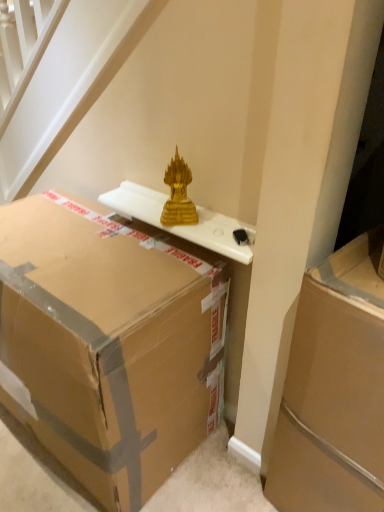
Image resolution: width=384 pixels, height=512 pixels. Describe the element at coordinates (334, 389) in the screenshot. I see `brown cardboard box at right, which is the second box from left to right` at that location.

What do you see at coordinates (183, 225) in the screenshot? I see `white glossy table at upper center` at bounding box center [183, 225].

Image resolution: width=384 pixels, height=512 pixels. I want to click on gold glass sculpture at upper center, so pyautogui.click(x=178, y=195).

Identify the location of brown cardboard box at right, arranged as the 1th box when viewed from the right. (334, 389).

From a real-world perspective, is gold glass sculpture at upper center above or below brown cardboard box at right, arranged as the 1th box when viewed from the right?

In terms of real-world spatial position, gold glass sculpture at upper center is above brown cardboard box at right, arranged as the 1th box when viewed from the right.

Between gold glass sculpture at upper center and brown cardboard box at right, arranged as the 1th box when viewed from the right, which one has larger size?

brown cardboard box at right, arranged as the 1th box when viewed from the right.

Is point (172, 175) positioned in front of point (319, 429)?

No.

From their relative heights in the image, would you say gold glass sculpture at upper center is taller or shorter than brown cardboard box at right, arranged as the 1th box when viewed from the right?

Considering their sizes, gold glass sculpture at upper center has less height than brown cardboard box at right, arranged as the 1th box when viewed from the right.

Where is `box directly beneath the brown cardboard box at right, which is the second box from left to right (from a real-world perspective)`? This screenshot has height=512, width=384. box directly beneath the brown cardboard box at right, which is the second box from left to right (from a real-world perspective) is located at coordinates tap(108, 345).

Is brown cardboard box at right, which is the second box from left to right, in contact with brown cardboard box at center, positioned as the 1th box in left-to-right order?

No, brown cardboard box at right, which is the second box from left to right, is not touching brown cardboard box at center, positioned as the 1th box in left-to-right order.

Can brown cardboard box at center, positioned as the 1th box in left-to-right order, be found inside brown cardboard box at right, arranged as the 1th box when viewed from the right?

Definitely not — brown cardboard box at center, positioned as the 1th box in left-to-right order, is not inside brown cardboard box at right, arranged as the 1th box when viewed from the right.

From the image's perspective, is brown cardboard box at right, which is the second box from left to right, over brown cardboard box at center, which appears as the second box when viewed from the right?

No, from the image's perspective, brown cardboard box at right, which is the second box from left to right, is not over brown cardboard box at center, which appears as the second box when viewed from the right.

Which is in front, point (65, 234) or point (178, 194)?

Positioned in front is point (178, 194).

From a real-world perspective, who is located lower, brown cardboard box at center, which appears as the second box when viewed from the right, or gold glass sculpture at upper center?

From a 3D spatial view, brown cardboard box at center, which appears as the second box when viewed from the right, is below.

Is brown cardboard box at center, positioned as the 1th box in left-to-right order, spatially inside gold glass sculpture at upper center, or outside of it?

brown cardboard box at center, positioned as the 1th box in left-to-right order, is not enclosed by gold glass sculpture at upper center.

Can you confirm if brown cardboard box at center, which appears as the second box when viewed from the right, is wider than gold glass sculpture at upper center?

Yes, brown cardboard box at center, which appears as the second box when viewed from the right, is wider than gold glass sculpture at upper center.

Can we say gold glass sculpture at upper center lies outside white glossy table at upper center?

Yes.

What's the angular difference between gold glass sculpture at upper center and white glossy table at upper center's facing directions?

The angle between the facing direction of gold glass sculpture at upper center and the facing direction of white glossy table at upper center is 0.00057 degrees.

Does point (176, 205) come closer to viewer compared to point (102, 195)?

Yes.

From a real-world perspective, is brown cardboard box at right, arranged as the 1th box when viewed from the right, on white glossy table at upper center?

Actually, brown cardboard box at right, arranged as the 1th box when viewed from the right, is physically below white glossy table at upper center in the real world.

Which is more to the right, brown cardboard box at right, arranged as the 1th box when viewed from the right, or white glossy table at upper center?

brown cardboard box at right, arranged as the 1th box when viewed from the right, is more to the right.

Are brown cardboard box at right, arranged as the 1th box when viewed from the right, and white glossy table at upper center making contact?

brown cardboard box at right, arranged as the 1th box when viewed from the right, is not next to white glossy table at upper center, and they're not touching.

Between brown cardboard box at right, arranged as the 1th box when viewed from the right, and white glossy table at upper center, which one is positioned behind?

white glossy table at upper center.

Which is further, (124, 217) or (311, 387)?

Point (124, 217)

From the image's perspective, which one is positioned higher, white glossy table at upper center or brown cardboard box at right, arranged as the 1th box when viewed from the right?

From the image's view, white glossy table at upper center is above.

Is white glossy table at upper center facing away from brown cardboard box at right, arranged as the 1th box when viewed from the right?

That's not correct — white glossy table at upper center is not looking away from brown cardboard box at right, arranged as the 1th box when viewed from the right.

Is brown cardboard box at right, arranged as the 1th box when viewed from the right, at the right side of gold glass sculpture at upper center?

Yes.

Can you tell me how much brown cardboard box at right, which is the second box from left to right, and gold glass sculpture at upper center differ in facing direction?

There is a 7.05-degree angle between the facing directions of brown cardboard box at right, which is the second box from left to right, and gold glass sculpture at upper center.

Is brown cardboard box at right, which is the second box from left to right, completely or partially outside of gold glass sculpture at upper center?

Yes.

From the image's perspective, is brown cardboard box at right, which is the second box from left to right, located above gold glass sculpture at upper center?

Actually, brown cardboard box at right, which is the second box from left to right, appears below gold glass sculpture at upper center in the image.

Locate an element on the screen. This screenshot has width=384, height=512. sculpture that appears above the brown cardboard box at right, which is the second box from left to right (from the image's perspective) is located at coordinates (178, 195).

Where is `box behind the brown cardboard box at right, which is the second box from left to right`? This screenshot has height=512, width=384. box behind the brown cardboard box at right, which is the second box from left to right is located at coordinates (108, 345).

From the image, which object appears to be nearer to white glossy table at upper center, brown cardboard box at center, positioned as the 1th box in left-to-right order, or brown cardboard box at right, arranged as the 1th box when viewed from the right?

brown cardboard box at center, positioned as the 1th box in left-to-right order.

From the image, which object appears to be nearer to brown cardboard box at right, which is the second box from left to right, brown cardboard box at center, which appears as the second box when viewed from the right, or white glossy table at upper center?

Among the two, white glossy table at upper center is located nearer to brown cardboard box at right, which is the second box from left to right.

Which object lies nearer to the anchor point brown cardboard box at center, positioned as the 1th box in left-to-right order, white glossy table at upper center or gold glass sculpture at upper center?

white glossy table at upper center.

From the image, which object appears to be farther from brown cardboard box at right, arranged as the 1th box when viewed from the right, white glossy table at upper center or brown cardboard box at center, positioned as the 1th box in left-to-right order?

The object further to brown cardboard box at right, arranged as the 1th box when viewed from the right, is brown cardboard box at center, positioned as the 1th box in left-to-right order.

When comparing their distances from brown cardboard box at right, arranged as the 1th box when viewed from the right, does brown cardboard box at center, positioned as the 1th box in left-to-right order, or gold glass sculpture at upper center seem further?

gold glass sculpture at upper center is positioned further to the anchor brown cardboard box at right, arranged as the 1th box when viewed from the right.

Considering their positions, is white glossy table at upper center positioned further to brown cardboard box at center, which appears as the second box when viewed from the right, than brown cardboard box at right, arranged as the 1th box when viewed from the right?

The object further to brown cardboard box at center, which appears as the second box when viewed from the right, is brown cardboard box at right, arranged as the 1th box when viewed from the right.

When comparing their distances from gold glass sculpture at upper center, does brown cardboard box at center, which appears as the second box when viewed from the right, or brown cardboard box at right, arranged as the 1th box when viewed from the right, seem further?

brown cardboard box at right, arranged as the 1th box when viewed from the right.

When comparing their distances from brown cardboard box at center, which appears as the second box when viewed from the right, does brown cardboard box at right, arranged as the 1th box when viewed from the right, or gold glass sculpture at upper center seem closer?

gold glass sculpture at upper center is closer to brown cardboard box at center, which appears as the second box when viewed from the right.

Find the location of a particular element. sculpture between brown cardboard box at center, which appears as the second box when viewed from the right, and brown cardboard box at right, arranged as the 1th box when viewed from the right, in the horizontal direction is located at coordinates (178, 195).

Where is `table that lies between gold glass sculpture at upper center and brown cardboard box at center, which appears as the second box when viewed from the right, from top to bottom`? table that lies between gold glass sculpture at upper center and brown cardboard box at center, which appears as the second box when viewed from the right, from top to bottom is located at coordinates (183, 225).

Image resolution: width=384 pixels, height=512 pixels. I want to click on table located between brown cardboard box at center, positioned as the 1th box in left-to-right order, and brown cardboard box at right, arranged as the 1th box when viewed from the right, in the left-right direction, so click(x=183, y=225).

Identify the location of table between gold glass sculpture at upper center and brown cardboard box at right, arranged as the 1th box when viewed from the right, in the vertical direction. (183, 225).